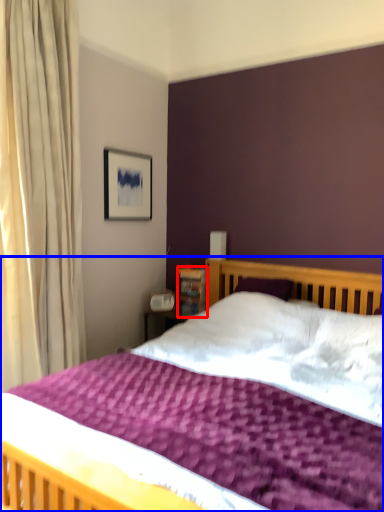
Question: Among these objects, which one is nearest to the camera, bookshelf (highlighted by a red box) or bed (highlighted by a blue box)?

Choices:
 (A) bookshelf
 (B) bed

Answer: (B)